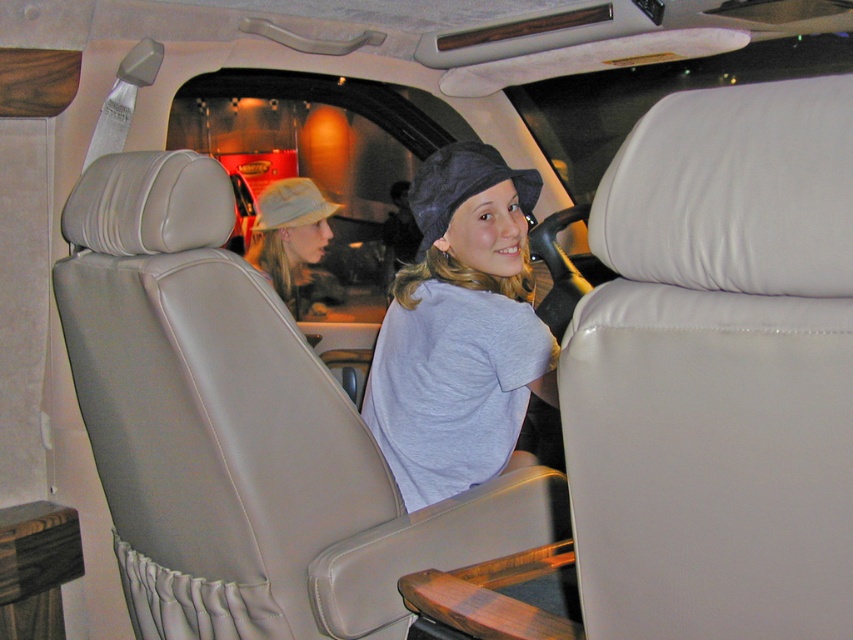
Is point (482, 333) closer to viewer compared to point (431, 211)?

Yes, point (482, 333) is in front of point (431, 211).

Between light gray cotton shirt at center and dark blue fabric baseball hat at center, which one is positioned higher?

dark blue fabric baseball hat at center is higher up.

Between point (518, 300) and point (521, 188), which one is positioned in front?

Point (518, 300) is more forward.

Find the location of a particular element. The width and height of the screenshot is (853, 640). light gray cotton shirt at center is located at coordinates (459, 330).

Is light gray cotton shirt at center closer to camera compared to khaki fabric baseball hat at center?

Yes, light gray cotton shirt at center is closer to the viewer.

Does point (479, 260) come farther from viewer compared to point (270, 204)?

No.

Where is `light gray cotton shirt at center`? The image size is (853, 640). light gray cotton shirt at center is located at coordinates (459, 330).

What do you see at coordinates (462, 186) in the screenshot? The width and height of the screenshot is (853, 640). I see `dark blue fabric baseball hat at center` at bounding box center [462, 186].

Is dark blue fabric baseball hat at center to the right of khaki fabric baseball hat at center from the viewer's perspective?

Correct, you'll find dark blue fabric baseball hat at center to the right of khaki fabric baseball hat at center.

Is point (495, 148) in front of point (308, 193)?

Yes.

The height and width of the screenshot is (640, 853). Identify the location of dark blue fabric baseball hat at center. (462, 186).